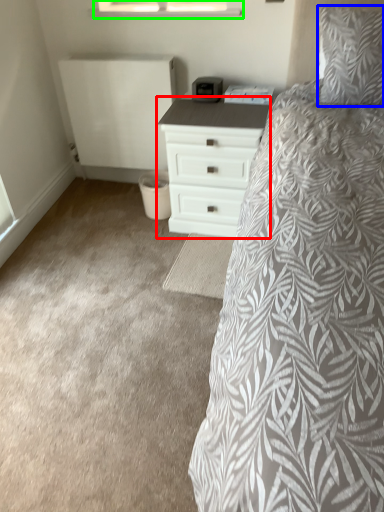
Question: Considering the real-world distances, which object is closest to chest of drawers (highlighted by a red box)? pillow (highlighted by a blue box) or window (highlighted by a green box).

Choices:
 (A) pillow
 (B) window

Answer: (A)